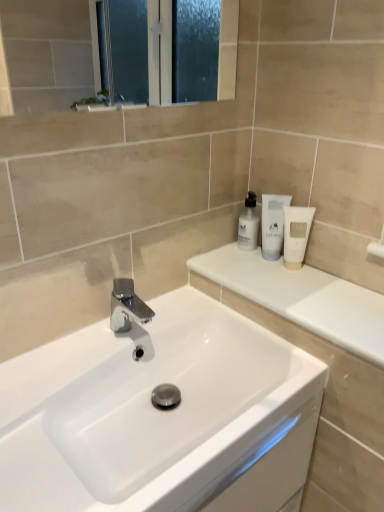
You are a GUI agent. You are given a task and a screenshot of the screen. Output one action in this format:
    pyautogui.click(x=<x>, y=<y>)
    Task: Click on the free space in front of white matte tube at upper right, the third toiletry viewed from the left
    This screenshot has height=512, width=384.
    Given the screenshot: What is the action you would take?
    pyautogui.click(x=310, y=296)